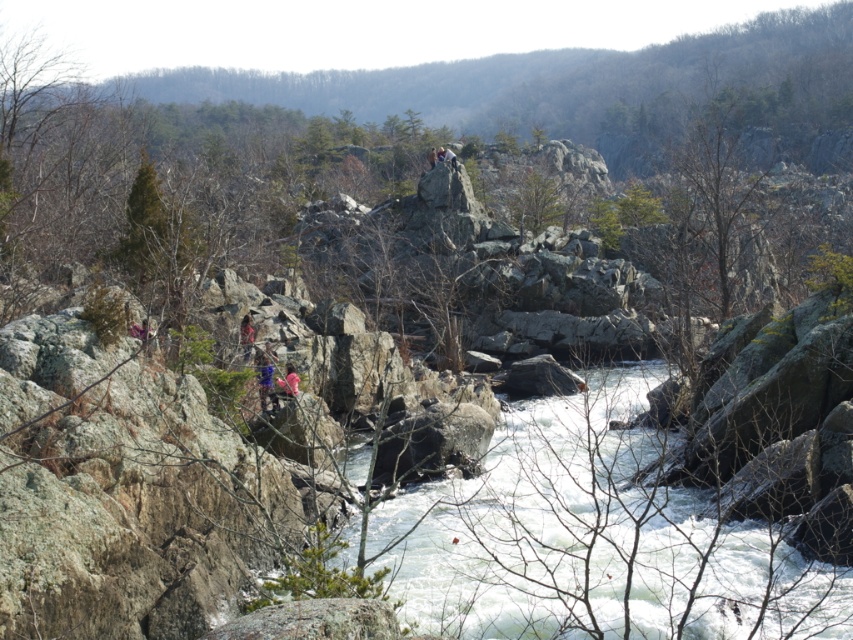
You are a photographer standing in the rugged natural landscape. You notice two figures in the scene, the blue fabric person at center and the matte pink shirt at center. Which figure appears closer to you?

The blue fabric person at center appears closer because it is smaller than the matte pink shirt at center, which suggests it is farther away due to perspective.

You are a hiker trying to cross the river in this rugged landscape. You see the white frothy water at center and the blue fabric person at center. Which object is closer to the river surface?

The white frothy water at center is below the blue fabric person at center, so it is closer to the river surface.